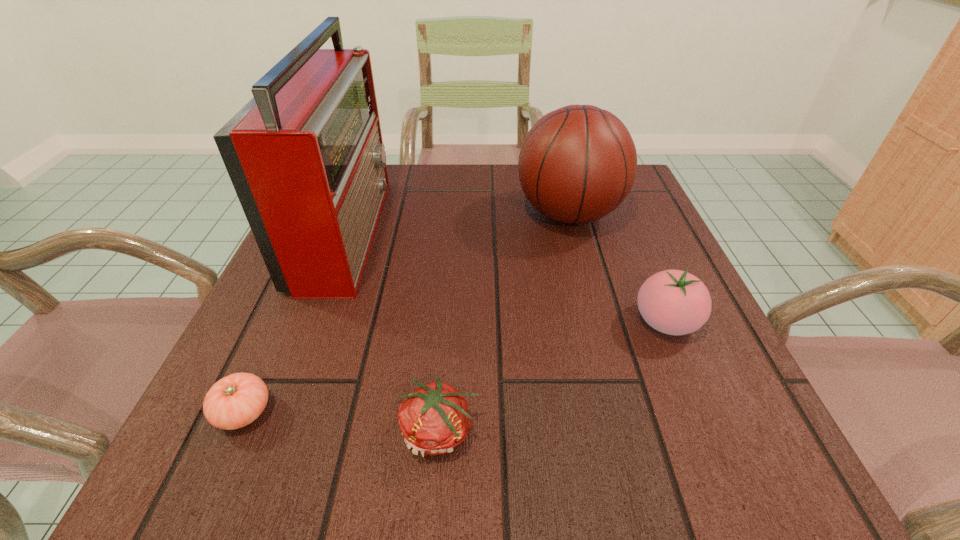
Identify which object is the nearest to the third object from left to right. Please provide its 2D coordinates. Your answer should be formatted as a tuple, i.e. [(x, y)], where the tuple contains the x and y coordinates of a point satisfying the conditions above.

[(234, 401)]

Locate which tomato is the second closest to the tallest object. Please provide its 2D coordinates. Your answer should be formatted as a tuple, i.e. [(x, y)], where the tuple contains the x and y coordinates of a point satisfying the conditions above.

[(434, 419)]

Select which tomato appears as the second closest to the rightmost tomato. Please provide its 2D coordinates. Your answer should be formatted as a tuple, i.e. [(x, y)], where the tuple contains the x and y coordinates of a point satisfying the conditions above.

[(234, 401)]

At what (x,y) coordinates should I click in order to perform the action: click on free space that satisfies the following two spatial constraints: 1. on the back side of the basketball; 2. on the right side of the second shortest tomato. Please return your answer as a coordinate pair (x, y). Image resolution: width=960 pixels, height=540 pixels. Looking at the image, I should click on (456, 214).

Find the location of a particular element. The height and width of the screenshot is (540, 960). vacant point that satisfies the following two spatial constraints: 1. on the front side of the basketball; 2. on the left side of the rightmost tomato is located at coordinates (597, 322).

In order to click on vacant point that satisfies the following two spatial constraints: 1. on the back side of the third tallest object; 2. on the left side of the shortest tomato in this screenshot , I will do pyautogui.click(x=284, y=322).

You are a GUI agent. You are given a task and a screenshot of the screen. Output one action in this format:
    pyautogui.click(x=<x>, y=<y>)
    Task: Click on the free location that satisfies the following two spatial constraints: 1. on the back side of the third shortest object; 2. on the front-facing side of the tallest object
    This screenshot has height=540, width=960.
    Given the screenshot: What is the action you would take?
    pyautogui.click(x=627, y=230)